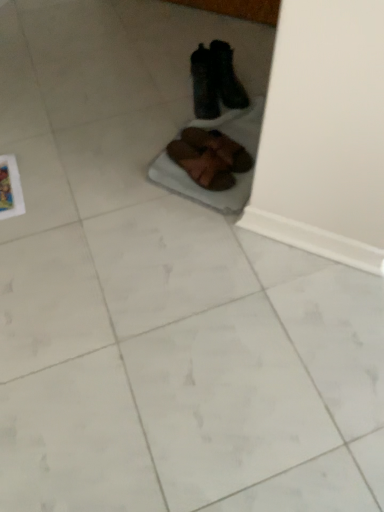
Question: Does brown suede shoes at center, placed as the 4th footwear when sorted from top to bottom, have a lesser height compared to brown suede shoes at center, marked as the second footwear in a bottom-to-top arrangement?

Choices:
 (A) no
 (B) yes

Answer: (B)

Question: Does brown suede shoes at center, placed as the 4th footwear when sorted from top to bottom, come behind brown suede shoes at center, marked as the second footwear in a bottom-to-top arrangement?

Choices:
 (A) no
 (B) yes

Answer: (A)

Question: From a real-world perspective, is brown suede shoes at center, placed as the 4th footwear when sorted from top to bottom, below brown suede shoes at center, which ranks as the third footwear in top-to-bottom order?

Choices:
 (A) yes
 (B) no

Answer: (A)

Question: Is brown suede shoes at center, the first footwear from the bottom, facing away from brown suede shoes at center, which ranks as the third footwear in top-to-bottom order?

Choices:
 (A) no
 (B) yes

Answer: (A)

Question: Is brown suede shoes at center, the first footwear from the bottom, bigger than brown suede shoes at center, marked as the second footwear in a bottom-to-top arrangement?

Choices:
 (A) yes
 (B) no

Answer: (A)

Question: Can you confirm if brown suede shoes at center, the first footwear from the bottom, is taller than brown suede shoes at center, which ranks as the third footwear in top-to-bottom order?

Choices:
 (A) yes
 (B) no

Answer: (B)

Question: From a real-world perspective, does black fuzzy slippers at center, positioned as the 2th footwear in top-to-bottom order, stand above brown suede shoes at center, marked as the second footwear in a bottom-to-top arrangement?

Choices:
 (A) yes
 (B) no

Answer: (A)

Question: From the image's perspective, is black fuzzy slippers at center, which ranks as the third footwear in bottom-to-top order, over brown suede shoes at center, which ranks as the third footwear in top-to-bottom order?

Choices:
 (A) yes
 (B) no

Answer: (A)

Question: Could you tell me if black fuzzy slippers at center, which ranks as the third footwear in bottom-to-top order, is facing brown suede shoes at center, which ranks as the third footwear in top-to-bottom order?

Choices:
 (A) yes
 (B) no

Answer: (B)

Question: Does black fuzzy slippers at center, which ranks as the third footwear in bottom-to-top order, have a lesser width compared to brown suede shoes at center, marked as the second footwear in a bottom-to-top arrangement?

Choices:
 (A) no
 (B) yes

Answer: (B)

Question: Is the position of black fuzzy slippers at center, positioned as the 2th footwear in top-to-bottom order, more distant than that of brown suede shoes at center, which ranks as the third footwear in top-to-bottom order?

Choices:
 (A) no
 (B) yes

Answer: (B)

Question: Considering the relative sizes of black fuzzy slippers at center, which ranks as the third footwear in bottom-to-top order, and brown suede shoes at center, marked as the second footwear in a bottom-to-top arrangement, in the image provided, is black fuzzy slippers at center, which ranks as the third footwear in bottom-to-top order, shorter than brown suede shoes at center, marked as the second footwear in a bottom-to-top arrangement,?

Choices:
 (A) no
 (B) yes

Answer: (A)

Question: Does black leather boots at upper center, which ranks as the fourth footwear in bottom-to-top order, have a lesser width compared to brown suede shoes at center, which ranks as the third footwear in top-to-bottom order?

Choices:
 (A) no
 (B) yes

Answer: (B)